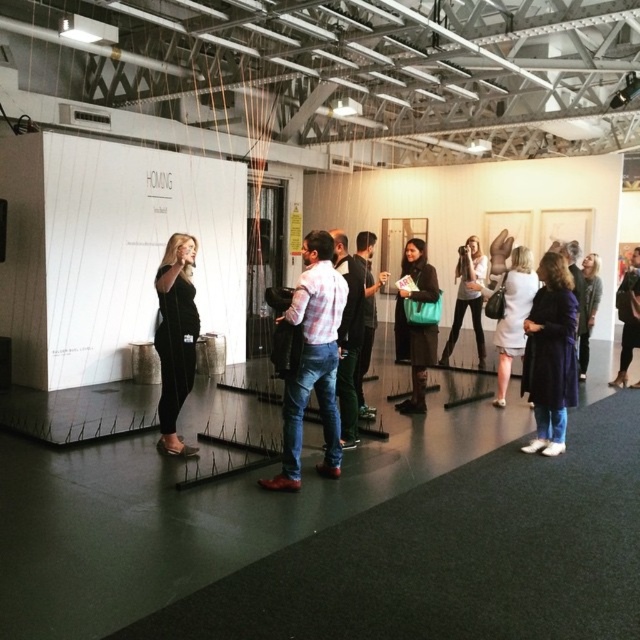
Can you confirm if black velvet dress at center is positioned below black leather jacket at center?

Yes, black velvet dress at center is below black leather jacket at center.

The image size is (640, 640). Describe the element at coordinates (176, 337) in the screenshot. I see `black velvet dress at center` at that location.

Describe the element at coordinates (176, 337) in the screenshot. I see `black velvet dress at center` at that location.

The height and width of the screenshot is (640, 640). I want to click on black velvet dress at center, so click(x=176, y=337).

Who is more forward, (x=348, y=292) or (x=481, y=356)?

Point (x=348, y=292)

Does point (344, 244) lie in front of point (468, 301)?

Yes, it is in front of point (468, 301).

You are a GUI agent. You are given a task and a screenshot of the screen. Output one action in this format:
    pyautogui.click(x=<x>, y=<y>)
    Task: Click on the white cotton shirt at center
    The height and width of the screenshot is (640, 640).
    Given the screenshot: What is the action you would take?
    pyautogui.click(x=348, y=339)

Who is taller, plaid shirt at center or white cotton shirt at center?

Standing taller between the two is white cotton shirt at center.

Is plaid shirt at center taller than white cotton shirt at center?

In fact, plaid shirt at center may be shorter than white cotton shirt at center.

Is point (275, 332) positioned in front of point (360, 330)?

That is True.

Locate an element on the screen. plaid shirt at center is located at coordinates (312, 360).